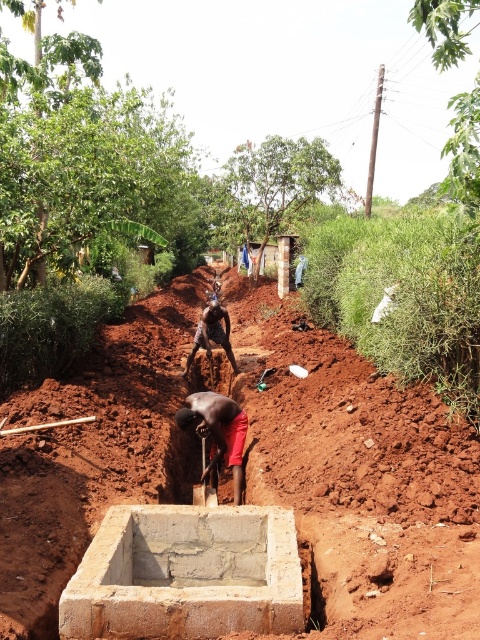
Question: Which of the following is the closest to the observer?

Choices:
 (A) metallic bronze statue at center
 (B) reddish-brown soil at center

Answer: (B)

Question: Which point is closer to the camera?

Choices:
 (A) (217, 438)
 (B) (40, 472)
 (C) (208, 547)

Answer: (C)

Question: Can you confirm if reddish-brown soil at center is positioned above light gray concrete foundation at center?

Choices:
 (A) yes
 (B) no

Answer: (A)

Question: Which object is closer to the camera taking this photo?

Choices:
 (A) light gray concrete foundation at center
 (B) dark skin person at center
 (C) metallic bronze statue at center

Answer: (A)

Question: Does light gray concrete foundation at center have a smaller size compared to metallic bronze statue at center?

Choices:
 (A) yes
 (B) no

Answer: (B)

Question: Considering the relative positions of light gray concrete foundation at center and dark skin person at center in the image provided, where is light gray concrete foundation at center located with respect to dark skin person at center?

Choices:
 (A) right
 (B) left

Answer: (B)